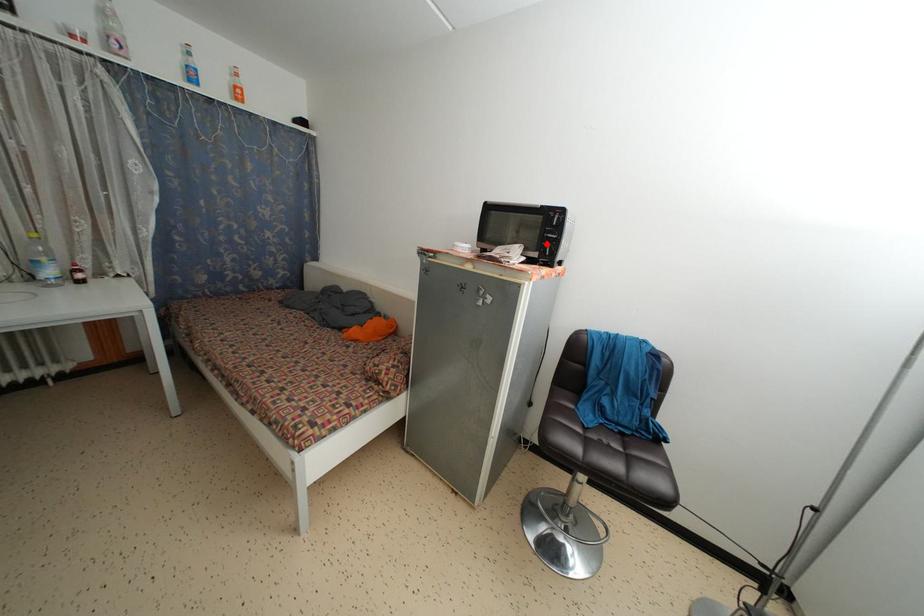
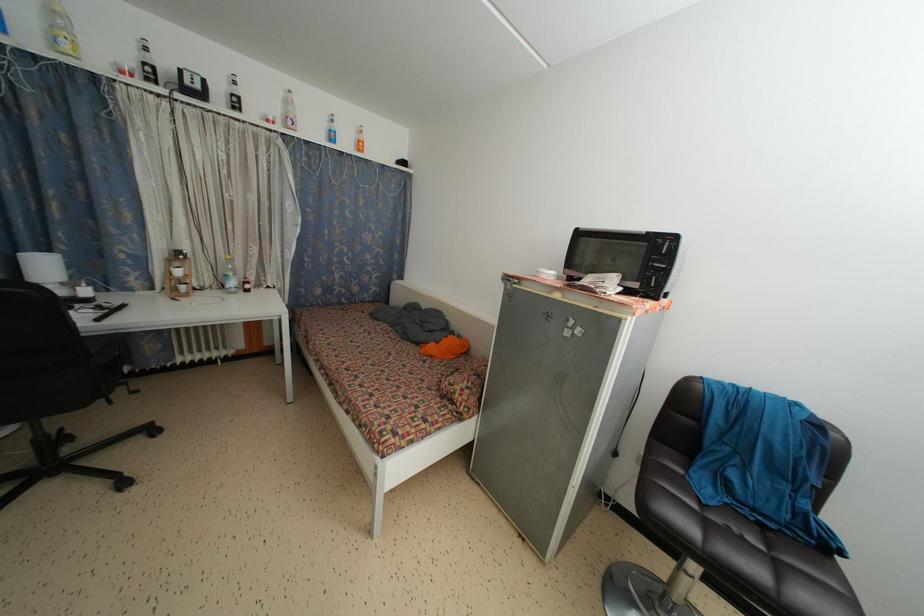
Locate, in the second image, the point that corresponds to the highlighted location in the first image.

(650, 273)